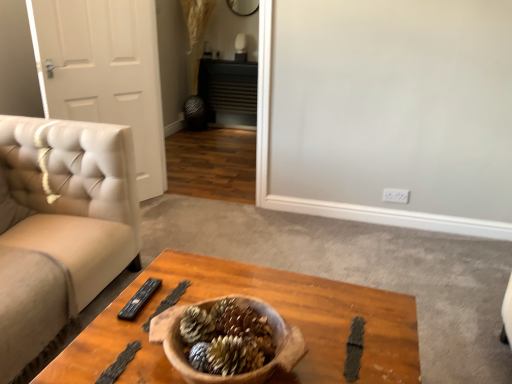
Question: Considering the relative sizes of black plastic remote at center and wooden coffee table at center in the image provided, is black plastic remote at center smaller than wooden coffee table at center?

Choices:
 (A) no
 (B) yes

Answer: (B)

Question: Does black plastic remote at center appear on the left side of wooden coffee table at center?

Choices:
 (A) yes
 (B) no

Answer: (A)

Question: Can you confirm if black plastic remote at center is positioned to the right of wooden coffee table at center?

Choices:
 (A) no
 (B) yes

Answer: (A)

Question: Does black plastic remote at center have a lesser height compared to wooden coffee table at center?

Choices:
 (A) no
 (B) yes

Answer: (B)

Question: Does black plastic remote at center turn towards wooden coffee table at center?

Choices:
 (A) no
 (B) yes

Answer: (A)

Question: Are black plastic remote at center and wooden coffee table at center far apart?

Choices:
 (A) yes
 (B) no

Answer: (B)

Question: From the image's perspective, is wooden coffee table at center under black plastic remote at center?

Choices:
 (A) yes
 (B) no

Answer: (A)

Question: Is the position of wooden coffee table at center more distant than that of black plastic remote at center?

Choices:
 (A) yes
 (B) no

Answer: (B)

Question: Is wooden coffee table at center smaller than black plastic remote at center?

Choices:
 (A) yes
 (B) no

Answer: (B)

Question: From a real-world perspective, is wooden coffee table at center located higher than black plastic remote at center?

Choices:
 (A) no
 (B) yes

Answer: (A)

Question: Does wooden coffee table at center have a lesser height compared to black plastic remote at center?

Choices:
 (A) yes
 (B) no

Answer: (B)

Question: Is wooden coffee table at center thinner than black plastic remote at center?

Choices:
 (A) yes
 (B) no

Answer: (B)

Question: Is white leather door at left surrounded by wooden coffee table at center?

Choices:
 (A) yes
 (B) no

Answer: (B)